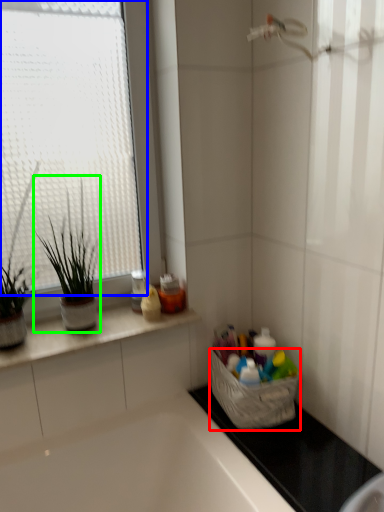
Question: Which object is the farthest from basket (highlighted by a red box)? Choose among these: window (highlighted by a blue box) or houseplant (highlighted by a green box).

Choices:
 (A) window
 (B) houseplant

Answer: (A)